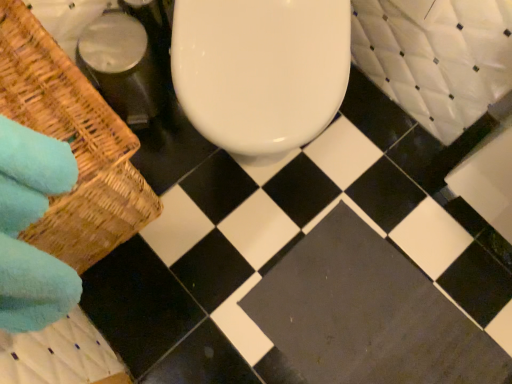
Find the location of a particular element. The height and width of the screenshot is (384, 512). dark gray concrete at center is located at coordinates (367, 314).

The height and width of the screenshot is (384, 512). Describe the element at coordinates (367, 314) in the screenshot. I see `dark gray concrete at center` at that location.

Find the location of `woven brown basket at left`. woven brown basket at left is located at coordinates (72, 145).

Describe the element at coordinates (72, 145) in the screenshot. I see `woven brown basket at left` at that location.

Find the location of a particular element. This screenshot has height=384, width=512. dark gray concrete at center is located at coordinates (367, 314).

Which object is positioned more to the right, dark gray concrete at center or woven brown basket at left?

Positioned to the right is dark gray concrete at center.

Is the depth of dark gray concrete at center less than that of woven brown basket at left?

No, the depth of dark gray concrete at center is greater than that of woven brown basket at left.

Looking at this image, which is less distant, (424, 367) or (92, 158)?

Positioned in front is point (92, 158).

From the image's perspective, between dark gray concrete at center and woven brown basket at left, which one is located above?

From the image's view, woven brown basket at left is above.

From a real-world perspective, does dark gray concrete at center stand above woven brown basket at left?

Incorrect, from a real-world perspective, dark gray concrete at center is lower than woven brown basket at left.

Considering the sizes of objects dark gray concrete at center and woven brown basket at left in the image provided, who is wider, dark gray concrete at center or woven brown basket at left?

woven brown basket at left.

Between dark gray concrete at center and woven brown basket at left, which one has less height?

dark gray concrete at center.

Does dark gray concrete at center have a larger size compared to woven brown basket at left?

Incorrect, dark gray concrete at center is not larger than woven brown basket at left.

Is woven brown basket at left a part of dark gray concrete at center?

Definitely not — woven brown basket at left is not inside dark gray concrete at center.

Is dark gray concrete at center placed right next to woven brown basket at left?

No, dark gray concrete at center is not with woven brown basket at left.

Looking at this image, is dark gray concrete at center facing away from woven brown basket at left?

dark gray concrete at center does not have its back to woven brown basket at left.

Looking at this image, how many degrees apart are the facing directions of dark gray concrete at center and woven brown basket at left?

There is a 86.7-degree angle between the facing directions of dark gray concrete at center and woven brown basket at left.

The height and width of the screenshot is (384, 512). I want to click on square that appears on the right of woven brown basket at left, so click(367, 314).

Which object is positioned more to the left, woven brown basket at left or dark gray concrete at center?

woven brown basket at left is more to the left.

Is woven brown basket at left in front of dark gray concrete at center?

Yes, the depth of woven brown basket at left is less than that of dark gray concrete at center.

Between point (134, 218) and point (334, 378), which one is positioned in front?

Point (334, 378)

Looking at this image, from the image's perspective, relative to dark gray concrete at center, is woven brown basket at left above or below?

Clearly, from the image's perspective, woven brown basket at left is above dark gray concrete at center.

From a real-world perspective, is woven brown basket at left under dark gray concrete at center?

Incorrect, from a real-world perspective, woven brown basket at left is higher than dark gray concrete at center.

Looking at this image, which of these two, woven brown basket at left or dark gray concrete at center, is thinner?

Thinner between the two is dark gray concrete at center.

Does woven brown basket at left have a lesser height compared to dark gray concrete at center?

Incorrect, the height of woven brown basket at left does not fall short of that of dark gray concrete at center.

Can you confirm if woven brown basket at left is bigger than dark gray concrete at center?

Correct, woven brown basket at left is larger in size than dark gray concrete at center.

Is woven brown basket at left surrounding dark gray concrete at center?

No, dark gray concrete at center is located outside of woven brown basket at left.

Based on the photo, does woven brown basket at left touch dark gray concrete at center?

No, woven brown basket at left is not in contact with dark gray concrete at center.

Is woven brown basket at left oriented towards dark gray concrete at center?

Yes, woven brown basket at left faces towards dark gray concrete at center.

The width and height of the screenshot is (512, 384). Identify the location of basket above the dark gray concrete at center (from a real-world perspective). (72, 145).

Where is `basket above the dark gray concrete at center (from a real-world perspective)`? basket above the dark gray concrete at center (from a real-world perspective) is located at coordinates (72, 145).

Where is `basket located above the dark gray concrete at center (from the image's perspective)`? basket located above the dark gray concrete at center (from the image's perspective) is located at coordinates (72, 145).